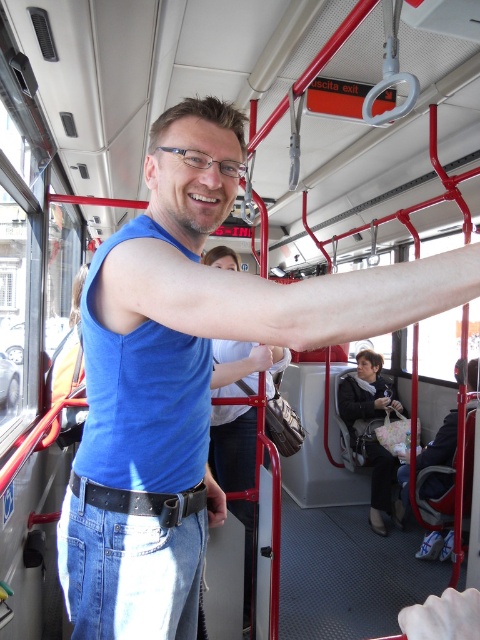
You are a photographer taking a picture of the black leather belt at center and the slightly pinkish skin at upper center. Which object should you focus on first if you want to capture both in the same frame without moving the camera?

You should focus on the black leather belt at center first because the slightly pinkish skin at upper center is positioned to the right of it, so keeping the belt in focus will ensure the skin is also within the depth of field.

You are a passenger on a bus and want to know where the slightly pinkish skin at upper center is located in the image. Can you tell me its coordinates?

The slightly pinkish skin at upper center is located at coordinates point (276, 296).